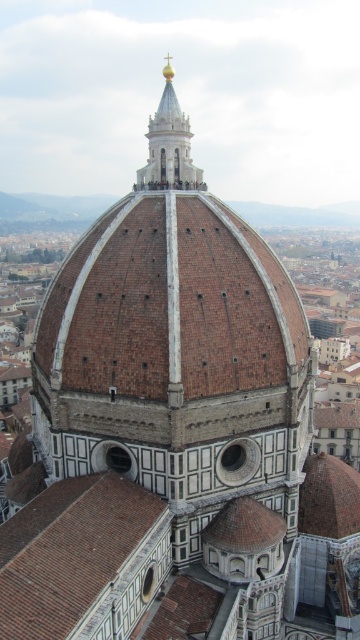
You are an architect planning to install a new decorative element on the Florence Cathedral. You have two options for placement based on the image. The first option is on the brown tile roof at lower left, and the second is on the gold polished spire at upper center. Which location offers a wider surface area for your design?

The brown tile roof at lower left offers a wider surface area for the design since its width surpasses that of the gold polished spire at upper center.

You are an architect examining the Florence Cathedral from above. You notice the brown tile roof at lower left and the gold polished spire at upper center. Which structure has a larger surface area?

The brown tile roof at lower left has a larger surface area than the gold polished spire at upper center.

Based on the photo, you are a drone operator planning to fly a drone from the brown tile roof at lower left to the gold polished spire at upper center. The drone has a maximum flight distance of 100 feet. Based on the scene, will the drone be able to reach the spire?

The distance between the brown tile roof at lower left and the gold polished spire at upper center is 111.74 feet, which exceeds the drone maximum flight distance of 100 feet. Therefore, the drone will not be able to reach the spire.